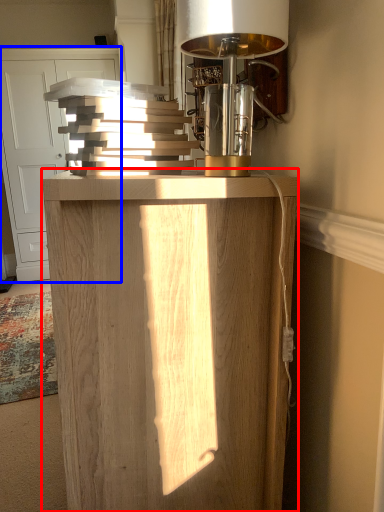
Question: Which point is closer to the camera, furniture (highlighted by a red box) or cabinetry (highlighted by a blue box)?

Choices:
 (A) furniture
 (B) cabinetry

Answer: (A)